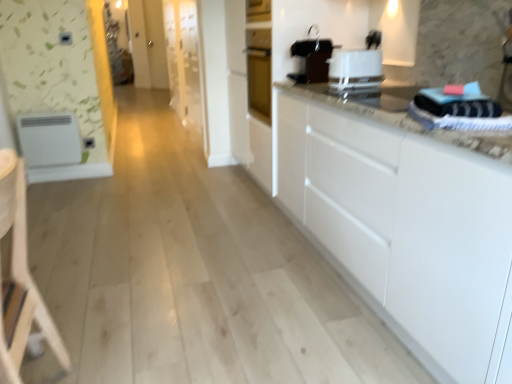
Question: Does black plastic coffee maker at upper center, the 2th appliance positioned from the left, have a lesser height compared to white glossy toaster at upper center?

Choices:
 (A) no
 (B) yes

Answer: (A)

Question: Does black plastic coffee maker at upper center, which is counted as the first appliance, starting from the top, come in front of white glossy toaster at upper center?

Choices:
 (A) no
 (B) yes

Answer: (A)

Question: Could you tell me if black plastic coffee maker at upper center, which appears as the 2th appliance when viewed from the back, is facing white glossy toaster at upper center?

Choices:
 (A) yes
 (B) no

Answer: (B)

Question: Considering the relative sizes of black plastic coffee maker at upper center, which appears as the first appliance when viewed from the front, and white glossy toaster at upper center in the image provided, is black plastic coffee maker at upper center, which appears as the first appliance when viewed from the front, thinner than white glossy toaster at upper center?

Choices:
 (A) no
 (B) yes

Answer: (B)

Question: From the image's perspective, does black plastic coffee maker at upper center, which is the 2th appliance in bottom-to-top order, appear higher than white glossy toaster at upper center?

Choices:
 (A) yes
 (B) no

Answer: (A)

Question: In terms of height, does white glossy toaster at upper center look taller or shorter compared to black plastic coffee maker at upper center, placed as the 1th appliance when sorted from right to left?

Choices:
 (A) short
 (B) tall

Answer: (A)

Question: Does point click(361, 57) appear closer or farther from the camera than point click(292, 79)?

Choices:
 (A) farther
 (B) closer

Answer: (B)

Question: Considering their positions, is white glossy toaster at upper center located in front of or behind black plastic coffee maker at upper center, which is the 2th appliance in bottom-to-top order?

Choices:
 (A) front
 (B) behind

Answer: (A)

Question: In terms of size, does white glossy toaster at upper center appear bigger or smaller than black plastic coffee maker at upper center, which is counted as the first appliance, starting from the top?

Choices:
 (A) big
 (B) small

Answer: (B)

Question: Is point (377, 71) closer or farther from the camera than point (44, 157)?

Choices:
 (A) farther
 (B) closer

Answer: (B)

Question: Is white glossy toaster at upper center in front of or behind white matte refrigerator at left, placed as the second appliance when sorted from right to left, in the image?

Choices:
 (A) front
 (B) behind

Answer: (A)

Question: Looking at the image, does white glossy toaster at upper center seem bigger or smaller compared to white matte refrigerator at left, arranged as the first appliance when viewed from the back?

Choices:
 (A) small
 (B) big

Answer: (A)

Question: From the image's perspective, is white glossy toaster at upper center above or below white matte refrigerator at left, arranged as the first appliance when viewed from the back?

Choices:
 (A) above
 (B) below

Answer: (A)

Question: Would you say black plastic coffee maker at upper center, which is the 2th appliance in bottom-to-top order, is to the left or to the right of white glossy toaster at upper center in the picture?

Choices:
 (A) left
 (B) right

Answer: (A)

Question: Is black plastic coffee maker at upper center, which is counted as the first appliance, starting from the top, wider or thinner than white glossy toaster at upper center?

Choices:
 (A) wide
 (B) thin

Answer: (B)